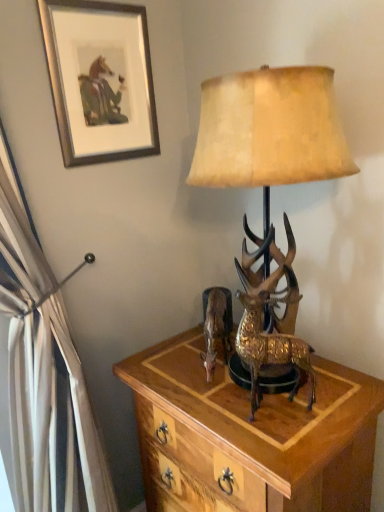
Identify the location of free space behind gold textured deer at center. The image size is (384, 512). (266, 386).